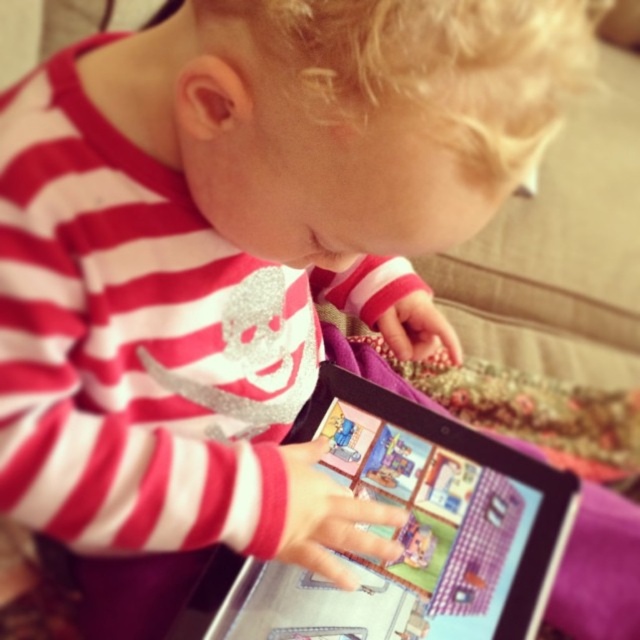
Question: Is silver metallic tablet at center further to the viewer compared to matte plastic tablet at center?

Choices:
 (A) yes
 (B) no

Answer: (B)

Question: Which of the following is the farthest from the observer?

Choices:
 (A) (444, 579)
 (B) (212, 595)

Answer: (A)

Question: Is silver metallic tablet at center to the left of matte plastic tablet at center from the viewer's perspective?

Choices:
 (A) no
 (B) yes

Answer: (B)

Question: Which point is farther from the camera taking this photo?

Choices:
 (A) (490, 509)
 (B) (460, 481)

Answer: (B)

Question: Is silver metallic tablet at center above matte plastic tablet at center?

Choices:
 (A) no
 (B) yes

Answer: (B)

Question: Which object appears closest to the camera in this image?

Choices:
 (A) silver metallic tablet at center
 (B) matte plastic tablet at center

Answer: (A)